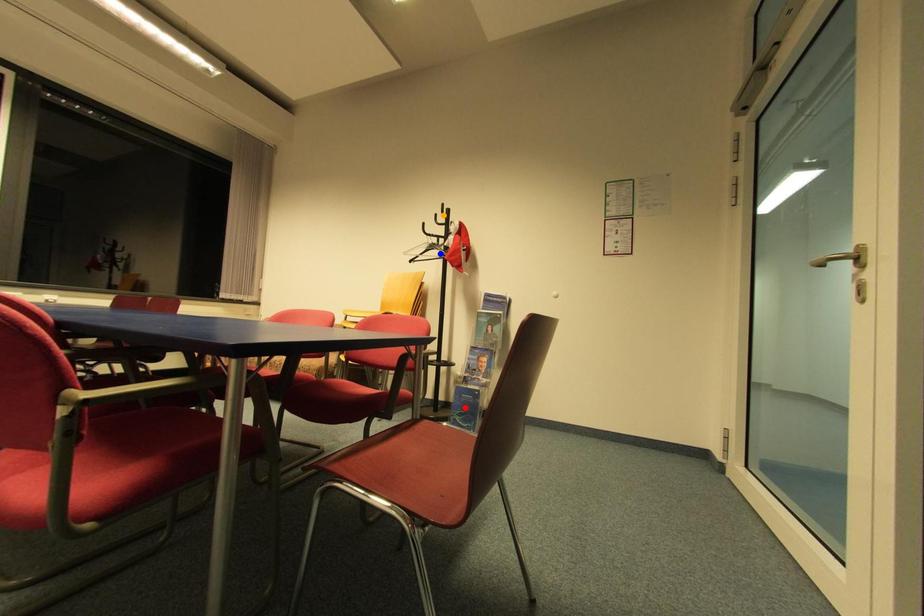
Looking at this image, order these from farthest to nearest:
orange point | red point | blue point

1. orange point
2. red point
3. blue point